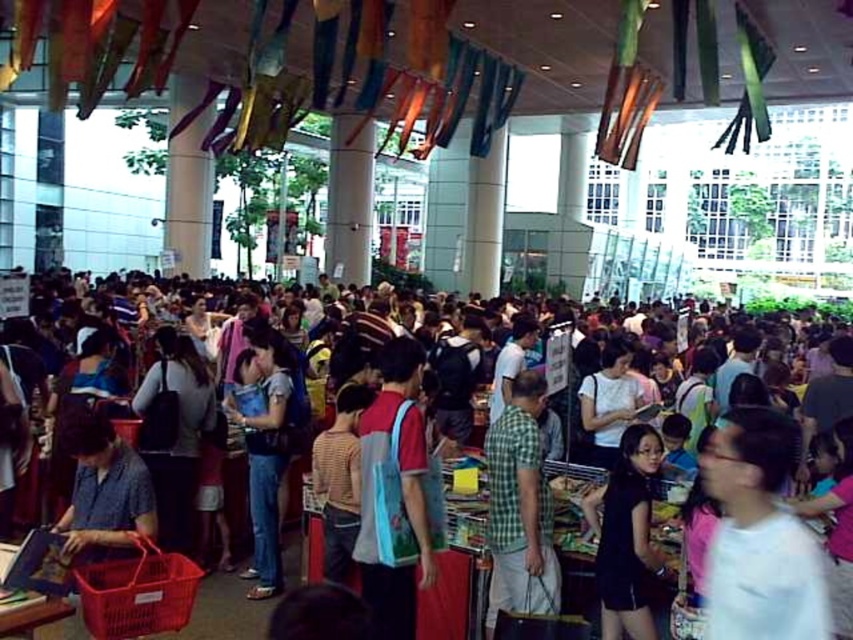
Consider the image. Is blue fabric bag at center to the right of denim jeans at center from the viewer's perspective?

Indeed, blue fabric bag at center is positioned on the right side of denim jeans at center.

Between blue fabric bag at center and denim jeans at center, which one appears on the left side from the viewer's perspective?

From the viewer's perspective, denim jeans at center appears more on the left side.

Between point (368, 449) and point (247, 392), which one is positioned in front?

Point (368, 449)

This screenshot has width=853, height=640. Identify the location of blue fabric bag at center. (397, 490).

Which is above, blue fabric bag at center or green plaid shirt at center?

blue fabric bag at center is higher up.

Can you confirm if blue fabric bag at center is shorter than green plaid shirt at center?

No.

This screenshot has height=640, width=853. Identify the location of blue fabric bag at center. coord(397,490).

The width and height of the screenshot is (853, 640). What do you see at coordinates (447, 596) in the screenshot?
I see `matte plastic bags at center` at bounding box center [447, 596].

From the picture: Who is higher up, matte plastic bags at center or black matte dress at lower right?

black matte dress at lower right is higher up.

Between point (508, 528) and point (608, 621), which one is positioned in front?

Point (608, 621) is in front.

Locate an element on the screen. matte plastic bags at center is located at coordinates (447, 596).